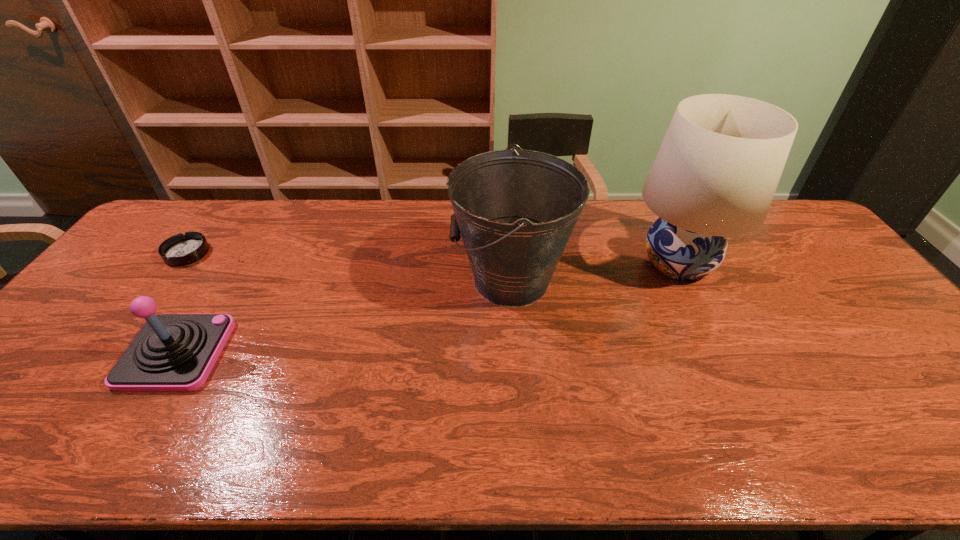
Locate an element on the screen. This screenshot has height=540, width=960. lampshade is located at coordinates (715, 175).

The height and width of the screenshot is (540, 960). Find the location of `the tallest object`. the tallest object is located at coordinates (715, 175).

The image size is (960, 540). What are the coordinates of `bucket` in the screenshot? It's located at point(516,210).

The height and width of the screenshot is (540, 960). I want to click on the second object from right to left, so click(x=516, y=210).

Identify the location of joystick. (172, 352).

Image resolution: width=960 pixels, height=540 pixels. I want to click on the shortest object, so click(181, 249).

Where is `free space located 0.070m on the front-facing side of the tallest object`? This screenshot has width=960, height=540. free space located 0.070m on the front-facing side of the tallest object is located at coordinates (603, 263).

The image size is (960, 540). Find the location of `vacant area located on the front-facing side of the tallest object`. vacant area located on the front-facing side of the tallest object is located at coordinates (597, 263).

Locate an element on the screen. Image resolution: width=960 pixels, height=540 pixels. vacant space located 0.300m on the front-facing side of the tallest object is located at coordinates (528, 263).

This screenshot has height=540, width=960. I want to click on blank space located 0.230m with the handle on opposite sides of the third object from left to right, so click(373, 280).